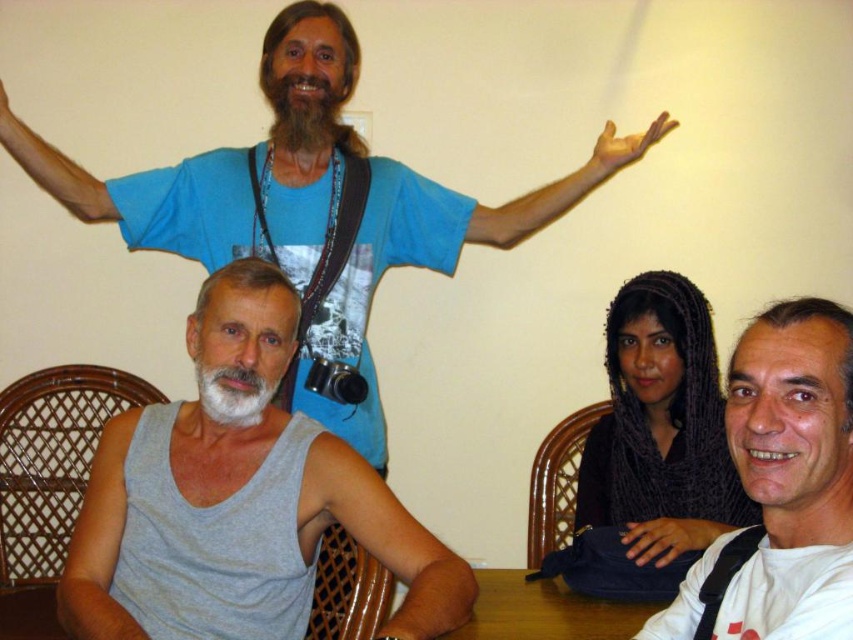
Looking at this image, can you confirm if white matte shirt at lower right is shorter than blue matte arm at upper center?

No.

Image resolution: width=853 pixels, height=640 pixels. What do you see at coordinates (781, 486) in the screenshot? I see `white matte shirt at lower right` at bounding box center [781, 486].

At what (x,y) coordinates should I click in order to perform the action: click on white matte shirt at lower right. Please return your answer as a coordinate pair (x, y). The image size is (853, 640). Looking at the image, I should click on (781, 486).

The height and width of the screenshot is (640, 853). In order to click on white matte shirt at lower right in this screenshot , I will do `click(781, 486)`.

Between gray fabric sleeve at lower left and dark brown fuzzy beard at upper center, which one appears on the left side from the viewer's perspective?

dark brown fuzzy beard at upper center

Does gray fabric sleeve at lower left come in front of dark brown fuzzy beard at upper center?

Yes, it is in front of dark brown fuzzy beard at upper center.

Who is more forward, (360, 515) or (315, 128)?

Point (360, 515)

Find the location of a particular element. The image size is (853, 640). gray fabric sleeve at lower left is located at coordinates (383, 540).

Does white matte shirt at lower right have a lesser width compared to white matte beard at lower left?

Incorrect, white matte shirt at lower right's width is not less than white matte beard at lower left's.

Does white matte shirt at lower right have a lesser height compared to white matte beard at lower left?

No.

This screenshot has height=640, width=853. What are the coordinates of `white matte shirt at lower right` in the screenshot? It's located at (781, 486).

You are a GUI agent. You are given a task and a screenshot of the screen. Output one action in this format:
    pyautogui.click(x=<x>, y=<y>)
    Task: Click on the white matte shirt at lower right
    Image resolution: width=853 pixels, height=640 pixels.
    Given the screenshot: What is the action you would take?
    (781, 486)